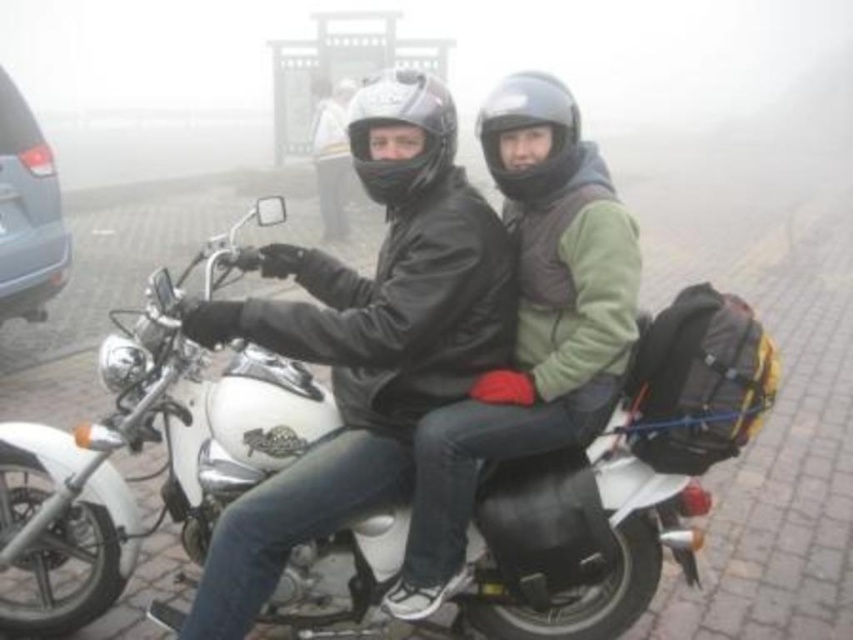
Question: Which object is the closest to the textured fabric backpack at rear?

Choices:
 (A) glossy black helmet at center
 (B) black matte helmet at center
 (C) metallic gray van at left
 (D) matte black motorcycle at center

Answer: (D)

Question: Considering the real-world distances, which object is closest to the glossy black helmet at center?

Choices:
 (A) metallic gray van at left
 (B) black matte helmet at center
 (C) matte black motorcycle at center

Answer: (B)

Question: Can you confirm if metallic gray van at left is positioned below black matte helmet at center?

Choices:
 (A) yes
 (B) no

Answer: (B)

Question: Among these points, which one is farthest from the camera?

Choices:
 (A) (550, 154)
 (B) (399, 76)
 (C) (235, 552)

Answer: (A)

Question: Does textured fabric backpack at rear have a smaller size compared to glossy black helmet at center?

Choices:
 (A) no
 (B) yes

Answer: (A)

Question: From the image, what is the correct spatial relationship of matte black motorcycle at center in relation to metallic gray van at left?

Choices:
 (A) below
 (B) above

Answer: (A)